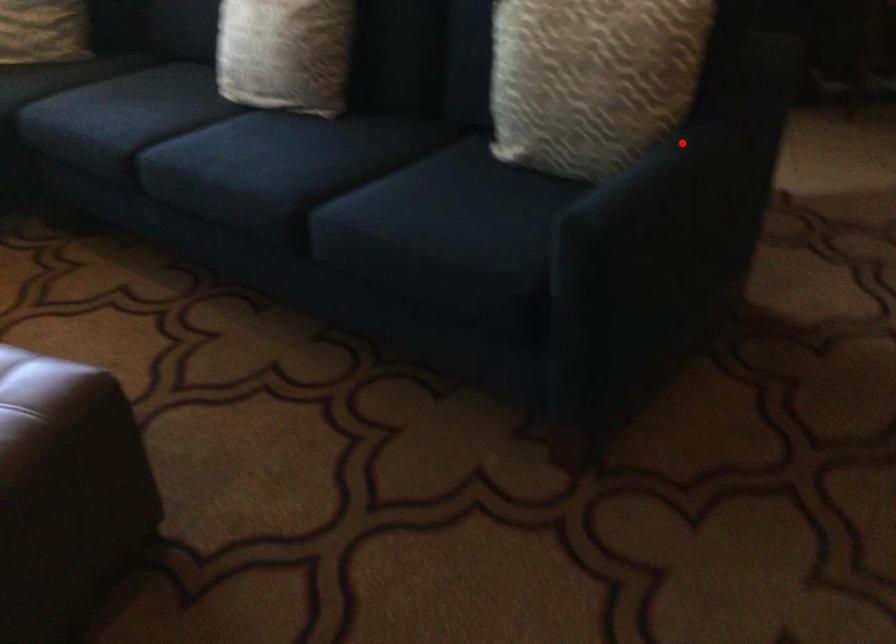
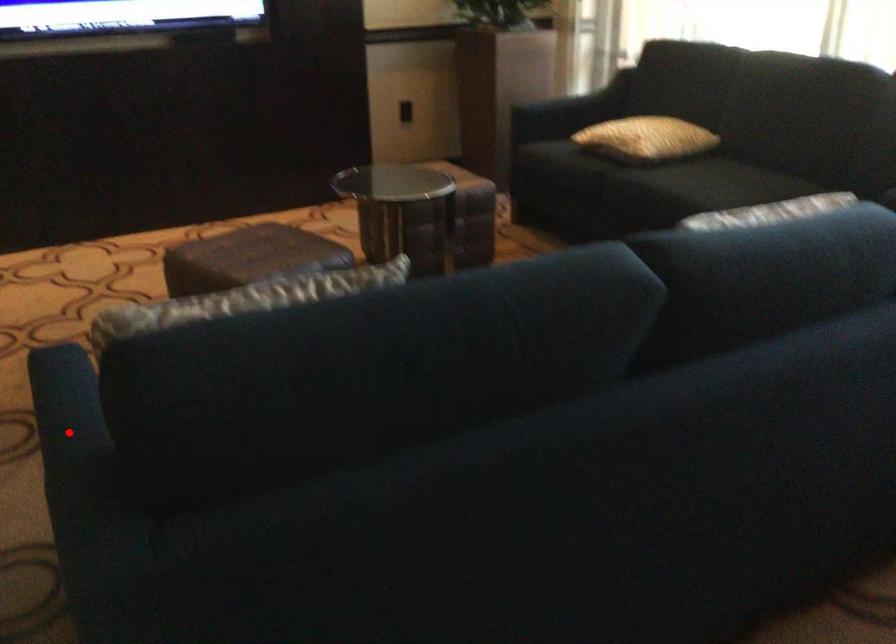
I am providing you with two images of the same scene from different viewpoints. A red point is marked on the first image and another point is marked on the second image. Is the marked point in image1 the same physical position as the marked point in image2?

Result: Yes